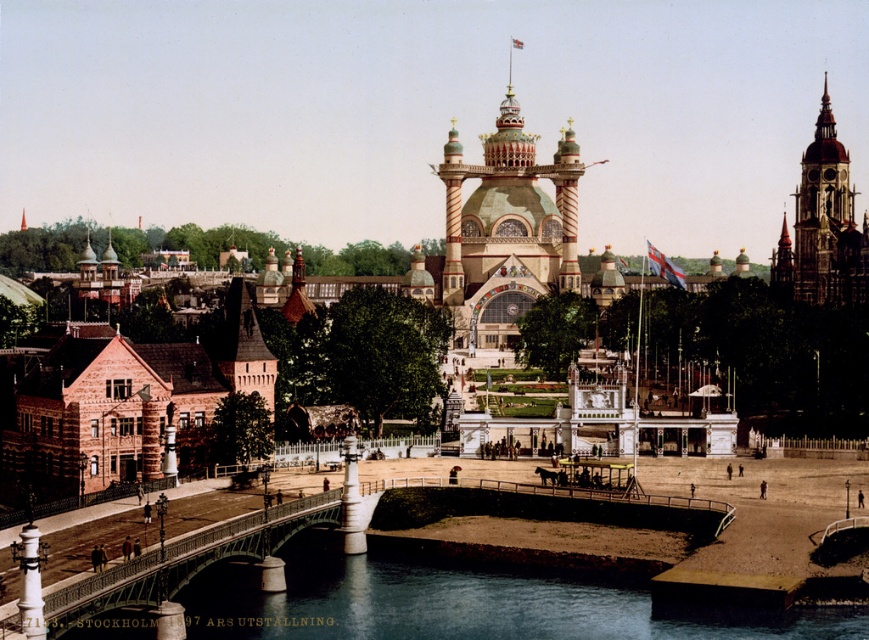
Between point (856, 634) and point (469, 250), which one is positioned behind?

Positioned behind is point (469, 250).

Can you confirm if smooth concrete river at lower left is taller than green textured dome at center?

Incorrect, smooth concrete river at lower left's height is not larger of green textured dome at center's.

Locate an element on the screen. smooth concrete river at lower left is located at coordinates (463, 602).

Is smooth concrete river at lower left to the left of green wrought iron bridge at lower left from the viewer's perspective?

In fact, smooth concrete river at lower left is to the right of green wrought iron bridge at lower left.

In the scene shown: Who is more distant from viewer, (615,596) or (296,513)?

The point (296,513) is behind.

Where is `smooth concrete river at lower left`? This screenshot has width=869, height=640. smooth concrete river at lower left is located at coordinates (463, 602).

Can you confirm if green textured dome at center is taller than green wrought iron bridge at lower left?

Indeed, green textured dome at center has a greater height compared to green wrought iron bridge at lower left.

Can you confirm if green textured dome at center is positioned to the right of green wrought iron bridge at lower left?

Indeed, green textured dome at center is positioned on the right side of green wrought iron bridge at lower left.

Which is behind, point (491, 234) or point (229, 522)?

Point (491, 234)

Image resolution: width=869 pixels, height=640 pixels. In order to click on green textured dome at center in this screenshot , I will do `click(506, 228)`.